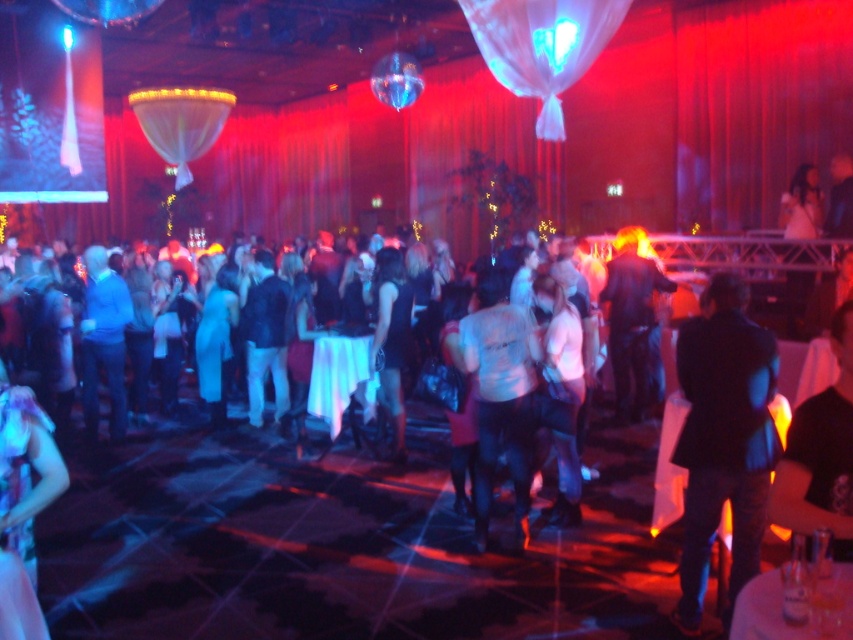
You are organizing a photo shoot and need to place two shirts on a mannequin stand. The white matte shirt at center and the black matte shirt at center must be arranged so that the wider shirt is on the left side. Based on the scene description, which shirt should be placed on the left?

The white matte shirt at center should be placed on the left because it is wider than the black matte shirt at center.

You are at a party and want to approach the black satin dress at center from the shiny purple dress at lower left. How far will you have to walk?

The shiny purple dress at lower left is 3.69 meters from the black satin dress at center, so you will have to walk approximately 3.69 meters to reach it.

You are at the party and want to greet both the person wearing the white matte shirt at center and the person wearing the black matte shirt at center. Which one should you approach first if you want to start with the one on the left?

You should approach the white matte shirt at center first because it is positioned to the left of the black matte shirt at center.